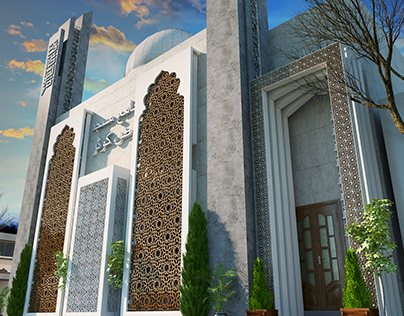
The image size is (404, 316). Identify the location of panels of glass on door. (308, 241), (321, 238), (320, 220), (307, 222).